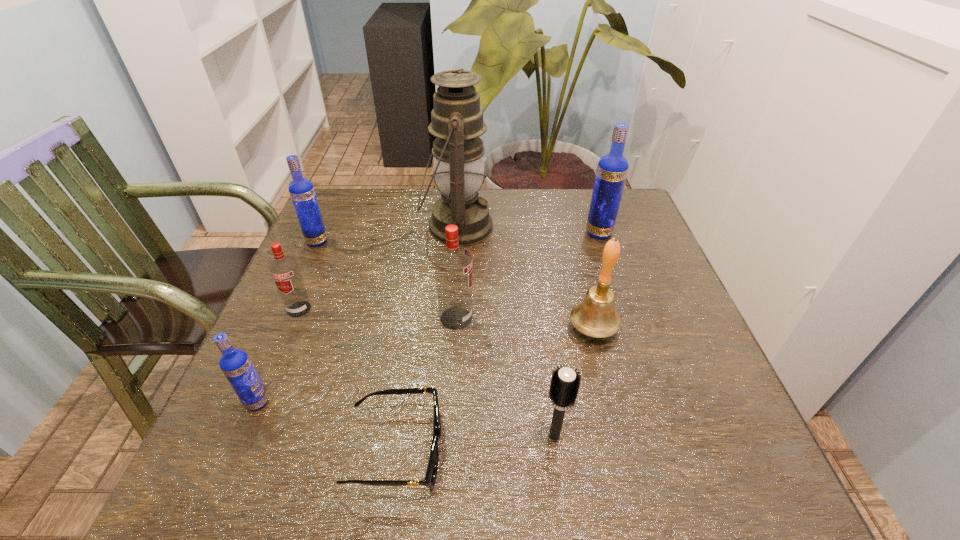
At what (x,y) coordinates should I click in order to perform the action: click on vacant area between the nearest vodka and the seventh object from left to right. Please return your answer as a coordinate pair (x, y). Looking at the image, I should click on (406, 419).

Identify the location of free space between the third object from right to left and the smaller red vodka. The height and width of the screenshot is (540, 960). (427, 373).

This screenshot has height=540, width=960. In order to click on vacant space that's between the hairbrush and the sunglasses in this screenshot , I will do `click(475, 442)`.

This screenshot has height=540, width=960. I want to click on object that is the closest one to the tallest vodka, so 457,122.

The width and height of the screenshot is (960, 540). Identify the location of object that stands as the seventh closest to the black sunglasses. (301, 190).

At what (x,y) coordinates should I click in order to perform the action: click on vodka object that ranks as the third closest to the third object from right to left. Please return your answer as a coordinate pair (x, y). Looking at the image, I should click on (284, 270).

Where is `vodka that stands as the closest to the nearest vodka`? vodka that stands as the closest to the nearest vodka is located at coordinates (284, 270).

Locate an element on the screen. The image size is (960, 540). blue vodka object that ranks as the second closest to the rightmost blue vodka is located at coordinates (235, 364).

At what (x,y) coordinates should I click in order to perform the action: click on blue vodka that is the third closest to the sunglasses. Please return your answer as a coordinate pair (x, y). The width and height of the screenshot is (960, 540). Looking at the image, I should click on (612, 169).

You are a GUI agent. You are given a task and a screenshot of the screen. Output one action in this format:
    pyautogui.click(x=<x>, y=<y>)
    Task: Click on the vacant position in the image that satisfies the following two spatial constraints: 1. on the front label of the hairbrush; 2. on the right side of the smaller red vodka
    
    Given the screenshot: What is the action you would take?
    pyautogui.click(x=246, y=436)